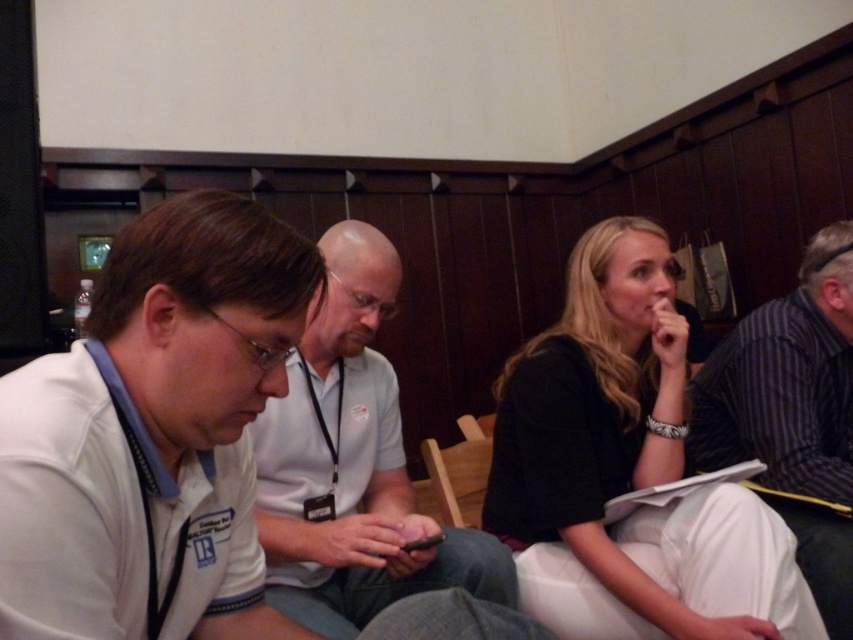
Can you confirm if black matte jacket at upper right is positioned below striped cotton shirt at right?

Actually, black matte jacket at upper right is above striped cotton shirt at right.

Does black matte jacket at upper right have a larger size compared to striped cotton shirt at right?

Indeed, black matte jacket at upper right has a larger size compared to striped cotton shirt at right.

Locate an element on the screen. This screenshot has width=853, height=640. black matte jacket at upper right is located at coordinates (627, 470).

Which of these two, white matte shirt at left or white matte shirt at center, stands taller?

white matte shirt at center is taller.

Is point (262, 298) positioned behind point (337, 573)?

That is False.

I want to click on white matte shirt at left, so click(x=154, y=429).

Is white matte shirt at left above black matte jacket at upper right?

Yes, white matte shirt at left is above black matte jacket at upper right.

Does white matte shirt at left have a smaller size compared to black matte jacket at upper right?

Yes, white matte shirt at left is smaller than black matte jacket at upper right.

Image resolution: width=853 pixels, height=640 pixels. In order to click on white matte shirt at left in this screenshot , I will do `click(154, 429)`.